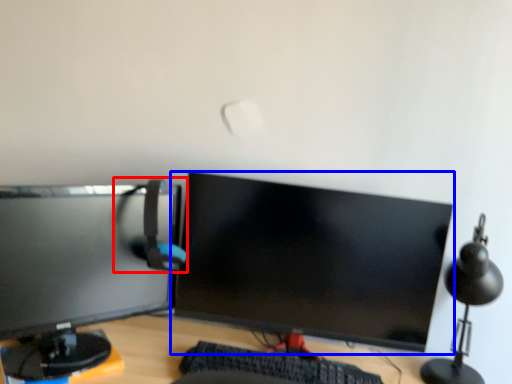
Question: Which point is closer to the camera, computer chair (highlighted by a red box) or computer monitor (highlighted by a blue box)?

Choices:
 (A) computer chair
 (B) computer monitor

Answer: (A)